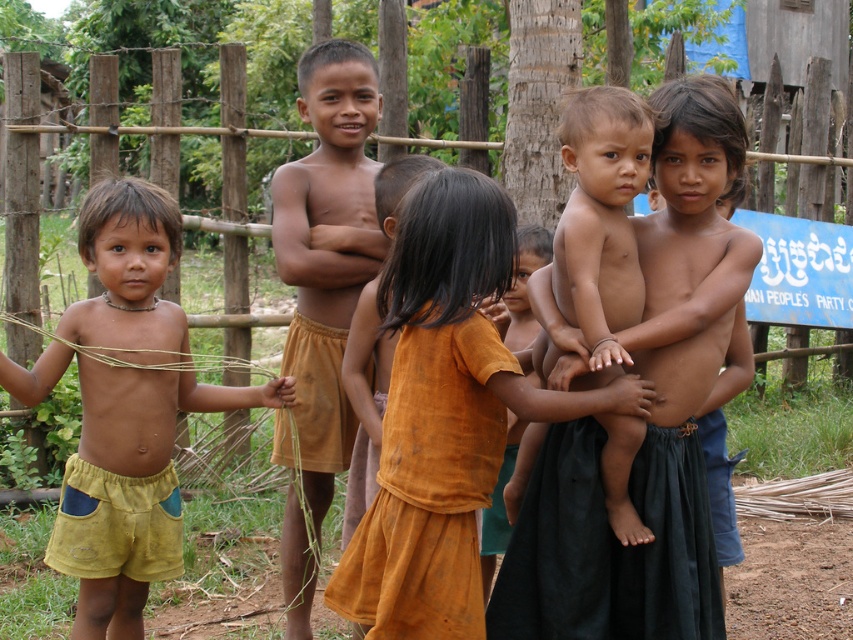
Between yellow cotton shorts at left and brown cotton shorts at center, which one appears on the left side from the viewer's perspective?

Positioned to the left is yellow cotton shorts at left.

Does yellow cotton shorts at left appear under brown cotton shorts at center?

Correct, yellow cotton shorts at left is located below brown cotton shorts at center.

Describe the element at coordinates (125, 410) in the screenshot. I see `yellow cotton shorts at left` at that location.

At what (x,y) coordinates should I click in order to perform the action: click on yellow cotton shorts at left. Please return your answer as a coordinate pair (x, y). The height and width of the screenshot is (640, 853). Looking at the image, I should click on (125, 410).

Does point (604, 540) come behind point (151, 252)?

No, it is in front of (151, 252).

You are a GUI agent. You are given a task and a screenshot of the screen. Output one action in this format:
    pyautogui.click(x=<x>, y=<y>)
    Task: Click on the brown skin boy at center
    This screenshot has height=640, width=853.
    Given the screenshot: What is the action you would take?
    click(x=650, y=417)

Describe the element at coordinates (650, 417) in the screenshot. The width and height of the screenshot is (853, 640). I see `brown skin boy at center` at that location.

Does point (596, 497) lie in front of point (418, 444)?

No, (596, 497) is further to viewer.

This screenshot has width=853, height=640. What are the coordinates of `brown skin boy at center` in the screenshot? It's located at (650, 417).